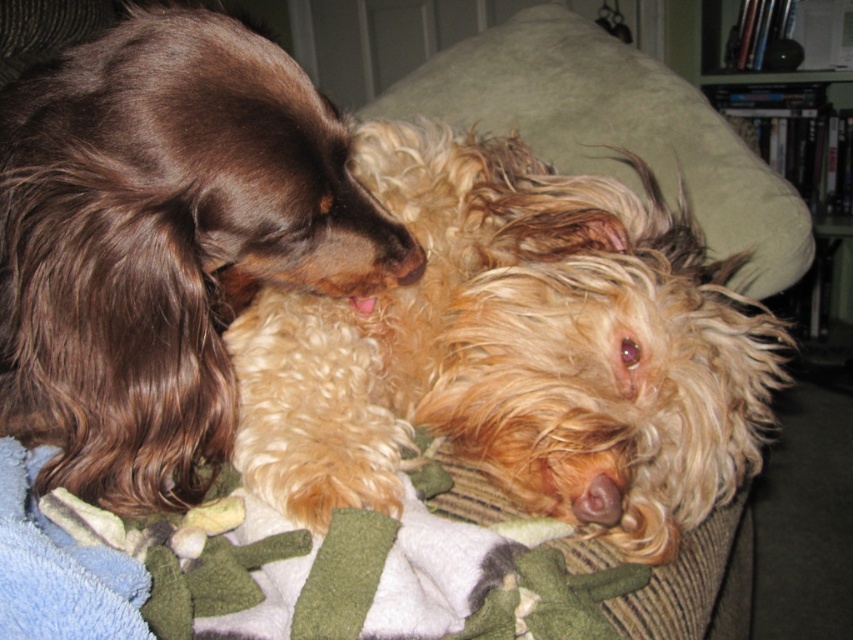
In the scene shown: Can you confirm if shiny brown fur at upper left is positioned above wooden bookshelf at upper right?

No, shiny brown fur at upper left is not above wooden bookshelf at upper right.

Is the position of shiny brown fur at upper left more distant than that of wooden bookshelf at upper right?

That is False.

The image size is (853, 640). I want to click on shiny brown fur at upper left, so click(x=163, y=243).

Is fuzzy golden dog at center smaller than green soft pillow at upper center?

Indeed, fuzzy golden dog at center has a smaller size compared to green soft pillow at upper center.

Is fuzzy golden dog at center below green soft pillow at upper center?

Yes.

Is point (454, 161) positioned before point (397, 108)?

Yes, point (454, 161) is in front of point (397, 108).

You are a GUI agent. You are given a task and a screenshot of the screen. Output one action in this format:
    pyautogui.click(x=<x>, y=<y>)
    Task: Click on the fuzzy golden dog at center
    
    Given the screenshot: What is the action you would take?
    pyautogui.click(x=515, y=352)

Can you confirm if fuzzy golden dog at center is shorter than soft fleece blanket at center?

Incorrect, fuzzy golden dog at center's height does not fall short of soft fleece blanket at center's.

Is fuzzy golden dog at center thinner than soft fleece blanket at center?

Incorrect, fuzzy golden dog at center's width is not less than soft fleece blanket at center's.

The width and height of the screenshot is (853, 640). Identify the location of fuzzy golden dog at center. (515, 352).